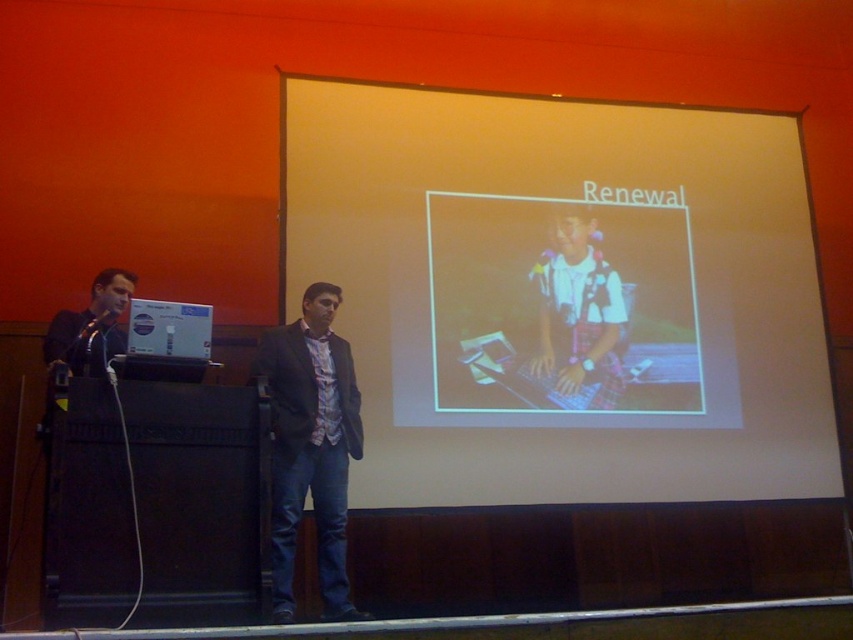
Question: Is matte black suit at center bigger than metallic shiny microphone at left?

Choices:
 (A) yes
 (B) no

Answer: (A)

Question: Which point is farther to the camera?

Choices:
 (A) plaid shirt at center
 (B) matte black suit at center
 (C) metallic silver microphone at upper center
 (D) metallic shiny microphone at left

Answer: (C)

Question: Which object appears closest to the camera in this image?

Choices:
 (A) matte black suit at left
 (B) white matte projector screen at center
 (C) matte plastic keyboard at center

Answer: (A)

Question: Which point is farther to the camera?

Choices:
 (A) metallic shiny microphone at left
 (B) plaid shirt at center

Answer: (B)

Question: Is white matte projector screen at center above matte plastic keyboard at center?

Choices:
 (A) no
 (B) yes

Answer: (B)

Question: Is matte plastic keyboard at center closer to the viewer compared to matte black suit at left?

Choices:
 (A) no
 (B) yes

Answer: (A)